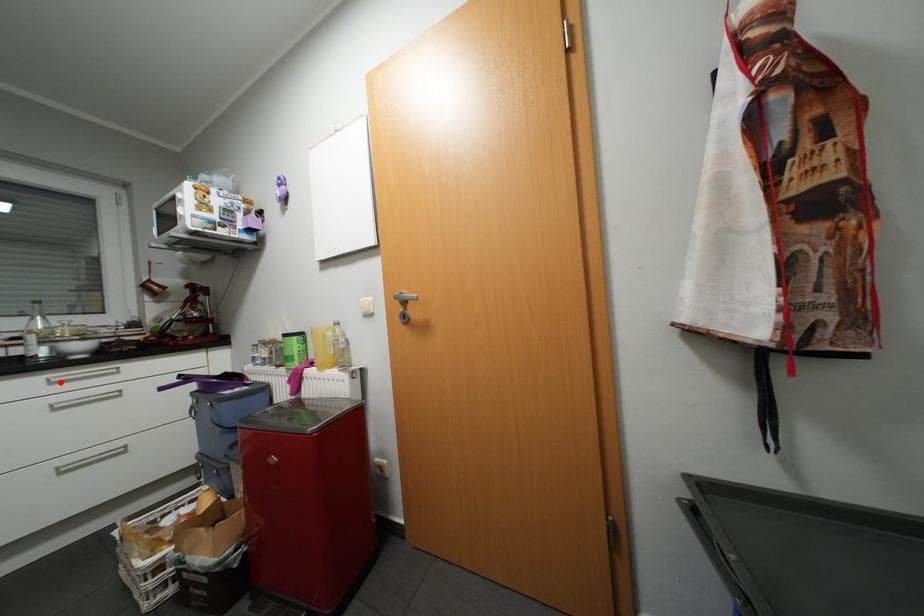
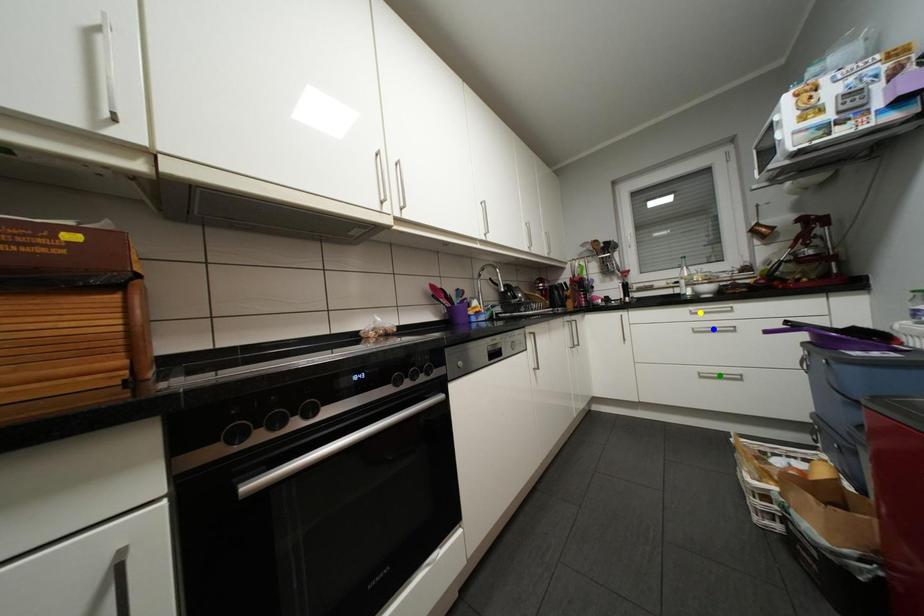
Question: I am providing you with two images of the same scene from different viewpoints. A red point is marked on the first image. You are given multiple points on the second image. Which point in image 2 is actually the same real-world point as the red point in image 1?

Choices:
 (A) blue point
 (B) green point
 (C) yellow point

Answer: (C)